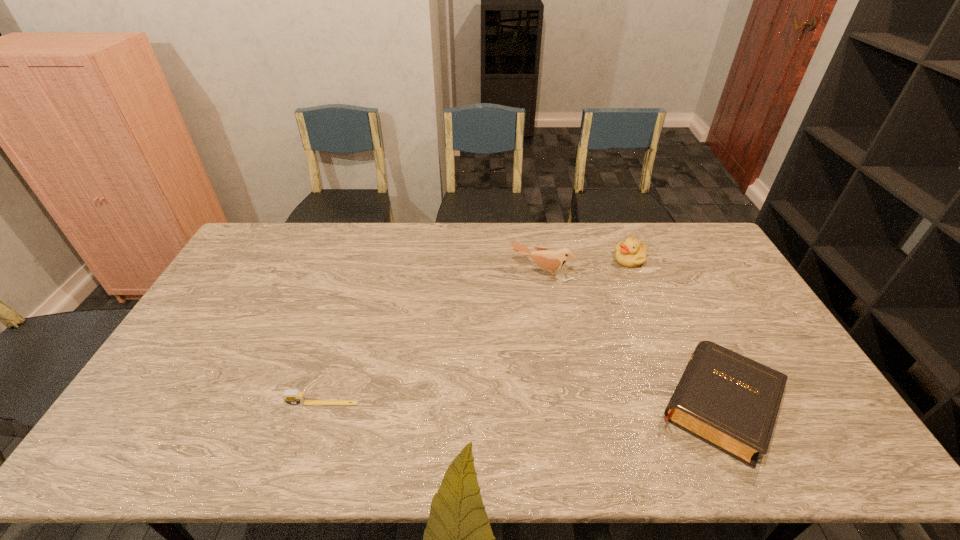
You are a GUI agent. You are given a task and a screenshot of the screen. Output one action in this format:
    pyautogui.click(x=<x>, y=<y>)
    Task: Click on the shortest object
    The image size is (960, 540).
    Given the screenshot: What is the action you would take?
    pyautogui.click(x=293, y=397)

Where is `the leftmost object`? Image resolution: width=960 pixels, height=540 pixels. the leftmost object is located at coordinates (293, 397).

Find the location of a particular element. The image size is (960, 540). Bible is located at coordinates (731, 402).

The height and width of the screenshot is (540, 960). Find the location of `bird`. bird is located at coordinates (547, 259).

Locate an element on the screen. The image size is (960, 540). the tallest object is located at coordinates (547, 259).

The width and height of the screenshot is (960, 540). Find the location of `duckling`. duckling is located at coordinates (631, 253).

Where is `free region located on the back of the Bible`? free region located on the back of the Bible is located at coordinates (673, 306).

Find the location of a particular element. blank space located 0.280m at the beak of the bird is located at coordinates (505, 342).

Identify the location of vacant space located 0.130m at the beak of the bird. (520, 308).

Find the location of a particular element. This screenshot has height=540, width=960. vacant space situated 0.050m at the beak of the bird is located at coordinates (527, 292).